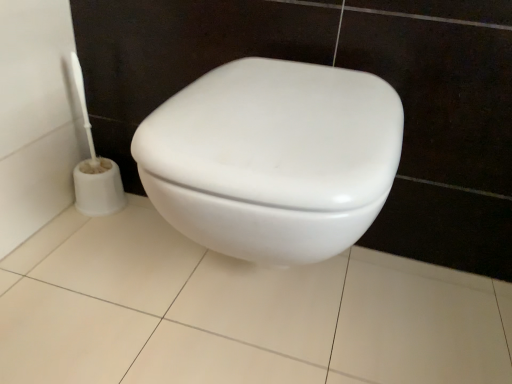
Identify the location of vacant region under white glossy toilet at center (from a real-world perspective). This screenshot has width=512, height=384. (265, 315).